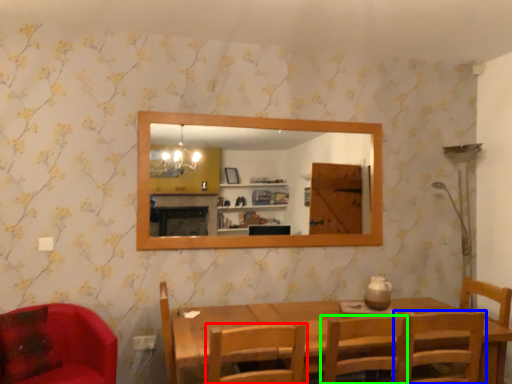
Question: Estimate the real-world distances between objects in this image. Which object is farther from chair (highlighted by a red box), chair (highlighted by a blue box) or chair (highlighted by a green box)?

Choices:
 (A) chair
 (B) chair

Answer: (A)